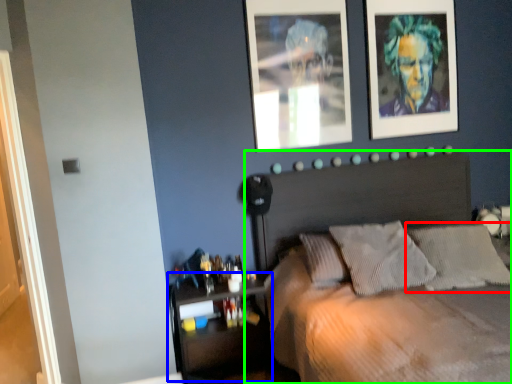
Question: Considering the real-world distances, which object is closest to pillow (highlighted by a red box)? shelf (highlighted by a blue box) or bed (highlighted by a green box).

Choices:
 (A) shelf
 (B) bed

Answer: (B)